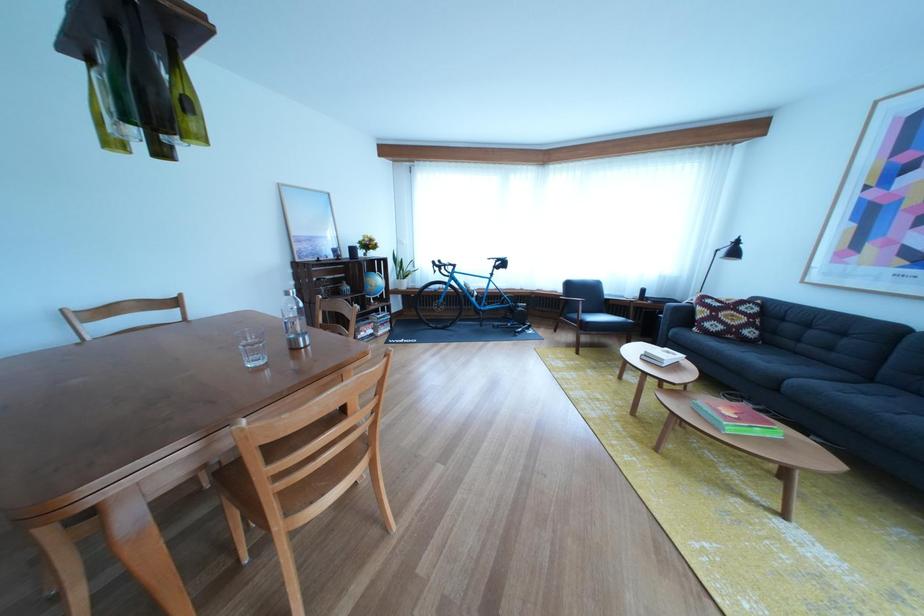
You are a GUI agent. You are given a task and a screenshot of the screen. Output one action in this format:
    pyautogui.click(x=<x>, y=<y>)
    Task: Click on the clear water bottle
    
    Given the screenshot: What is the action you would take?
    pyautogui.click(x=294, y=321)